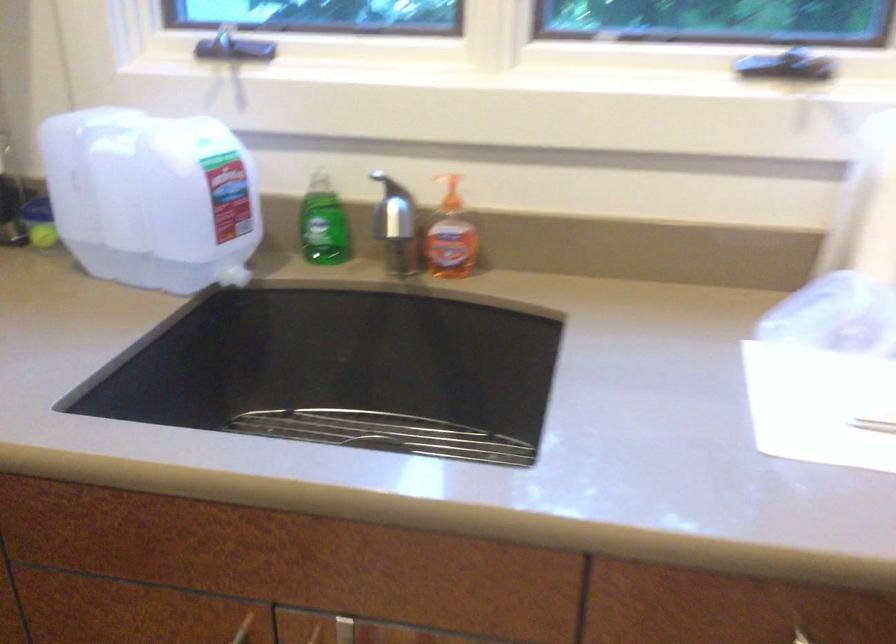
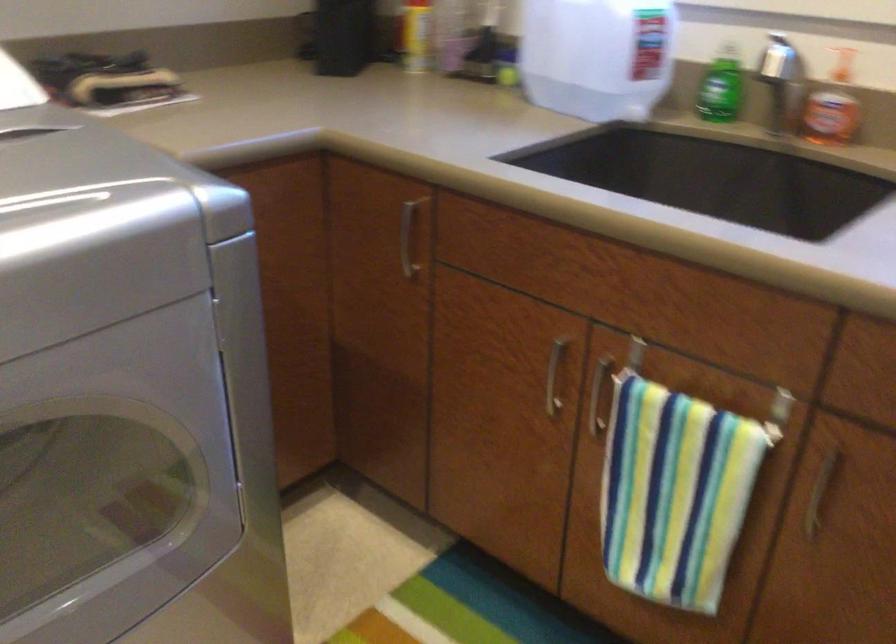
Locate, in the second image, the point that corresponds to the point at 405,230 in the first image.

(788, 96)